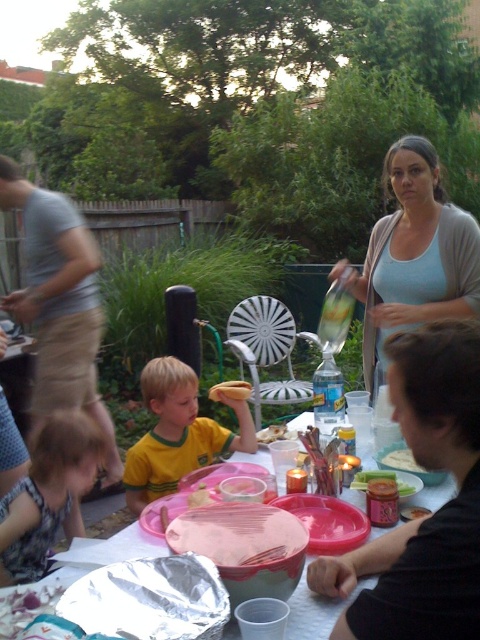
You are at a picnic table in the backyard and see the yellow jersey at center and the green matte cucumber at center. Which object is positioned to the left?

The yellow jersey at center is to the left of the green matte cucumber at center.